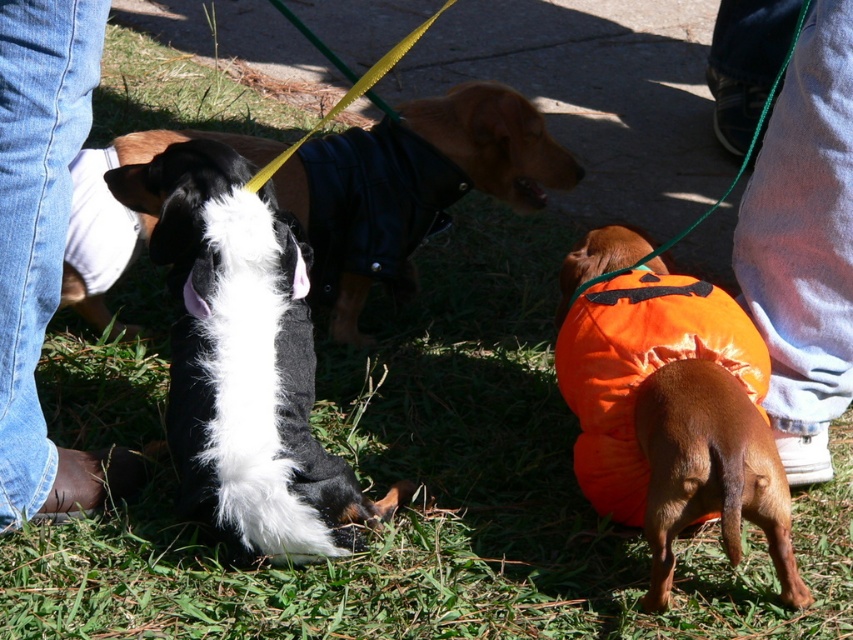
You are a photographer trying to capture a photo of the orange fabric dog at lower right and the denim pants at lower right. Since you want both subjects to be in focus, you need to know which one is wider. Which object is narrower?

The denim pants at lower right are narrower than the orange fabric dog at lower right because the denim pants at lower right has a smaller width.

You are a photographer setting up a tripod to capture a wide shot of the scene. The tripod has a maximum width capacity of 1.2 meters. You need to place the tripod so that it can support both the black leather jacket at center and the jeans at lower left. Based on their sizes, will the tripod be able to accommodate both items comfortably?

The black leather jacket at center has a larger width than the jeans at lower left. Since the tripod can support up to 1.2 meters, and the jacket is wider, as long as the jacket itself is within the 1.2 meter width limit, the tripod should be able to accommodate both items. However, if the jacket exceeds 1.2 meters, it won me. The exact width of the jacket isn

You are a photographer setting up equipment in the scene. You have a tripod that needs to be placed near the jeans at lower left without blocking the black leather jacket at center. Is this possible?

The black leather jacket at center is located above the jeans at lower left, so placing the tripod near the jeans at lower left should be possible as long as it is positioned below the jacket to avoid blocking it.